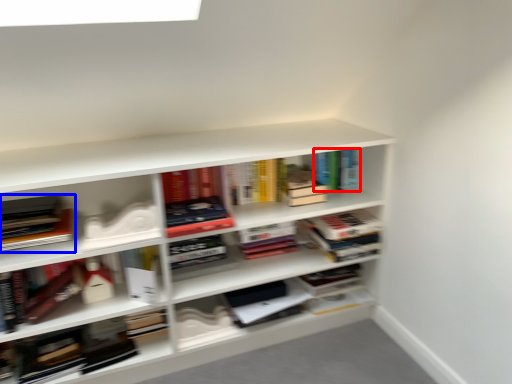
Question: Among these objects, which one is farthest to the camera, book (highlighted by a red box) or book (highlighted by a blue box)?

Choices:
 (A) book
 (B) book

Answer: (A)